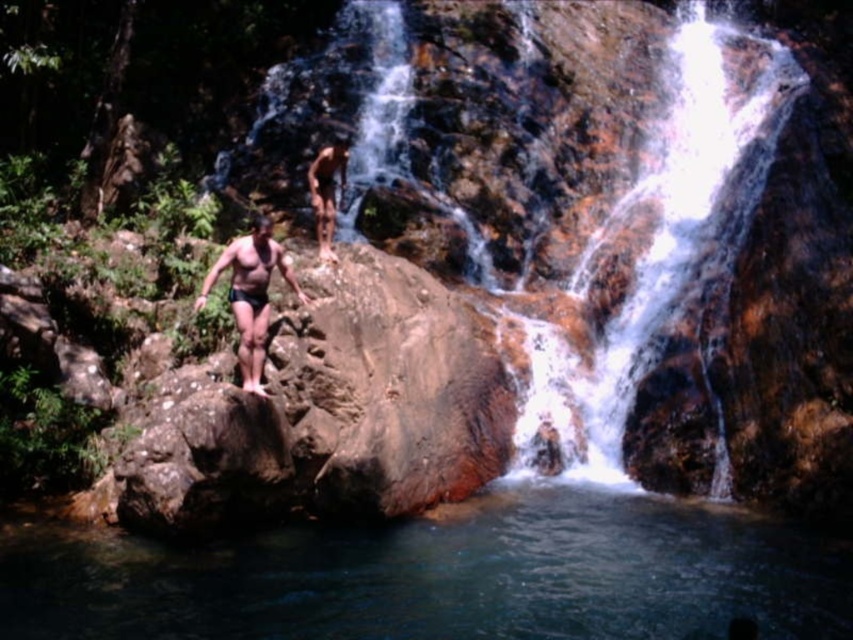
You are planning to jump into the clear blue water at center from the rock. The smooth skin man at center is already in the water. How does the water level compare to the man?

The clear blue water at center has a lesser height compared to smooth skin man at center, so the water level is lower than the man.

You are standing at the point marked as point (251, 294) in the image. What object are you currently standing on?

You are standing on the matte black shorts at center.